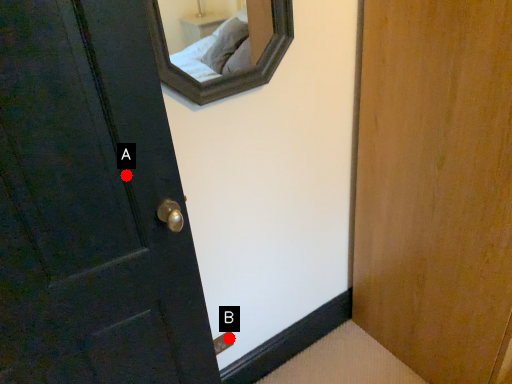
Question: Two points are circled on the image, labeled by A and B beside each circle. Which point is closer to the camera?

Choices:
 (A) A is closer
 (B) B is closer

Answer: (A)